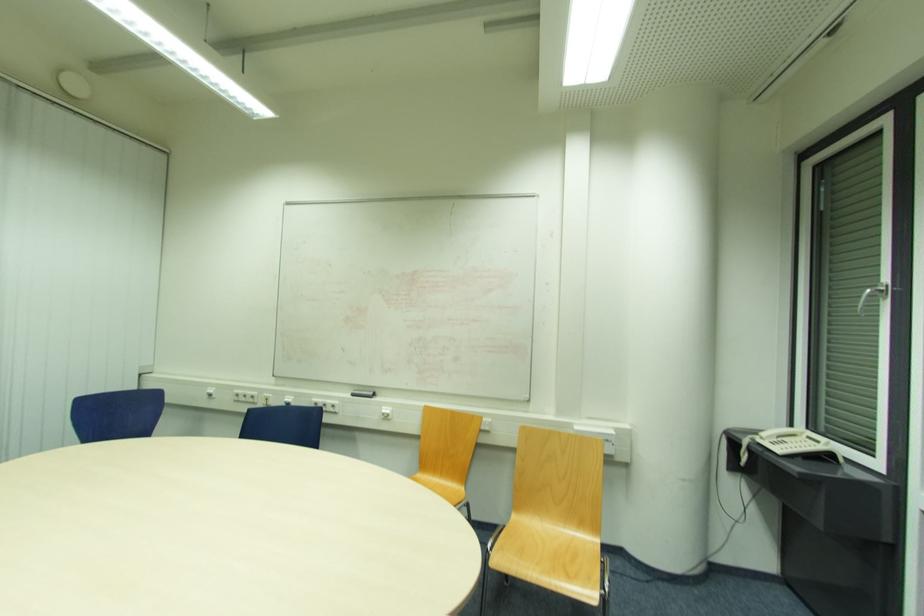
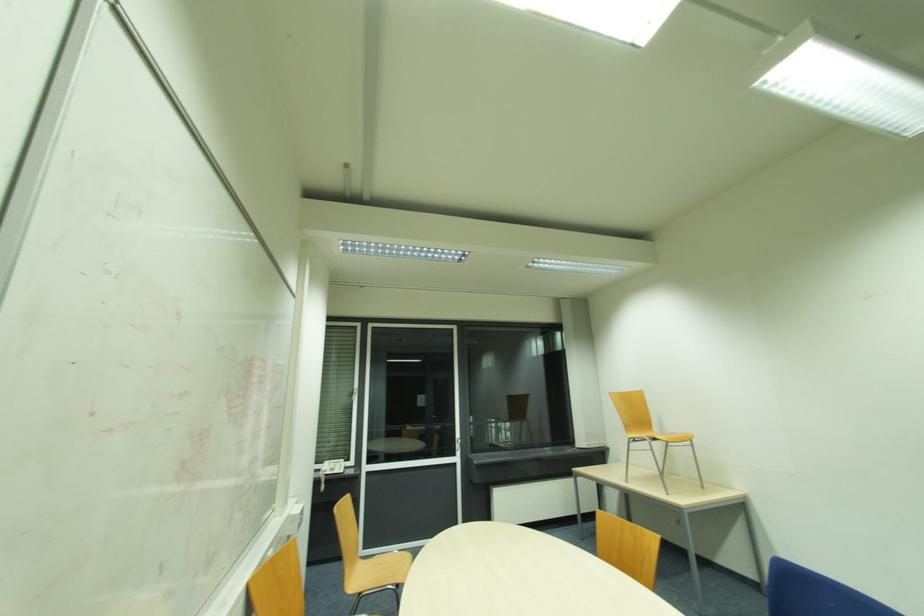
In the second image, find the point that corresponds to (809,438) in the first image.

(334, 463)